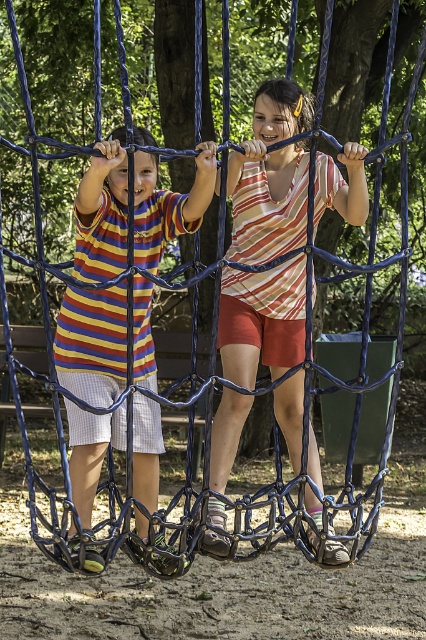
You are a photographer trying to capture a closeup of the striped cotton shirt at center. You notice a point marked at coordinates (270, 177). Is this point located on the striped cotton shirt at center?

Yes, the point (270, 177) is located on the striped cotton shirt at center according to the description.

You are a photographer trying to capture a photo of the striped cotton shirt at center. If your camera has a focus point at coordinate point 0.278, 0.634, will it align with the shirt?

Yes, the striped cotton shirt at center is exactly at point (x=270, y=177), so the focus point will align with the shirt.